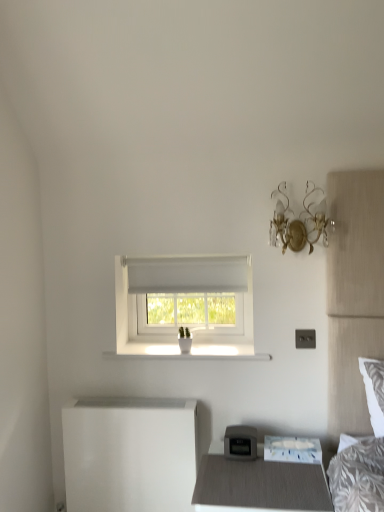
This screenshot has height=512, width=384. Find the location of `free space below white fabric window at center (from a real-world perspective)`. free space below white fabric window at center (from a real-world perspective) is located at coordinates (170, 347).